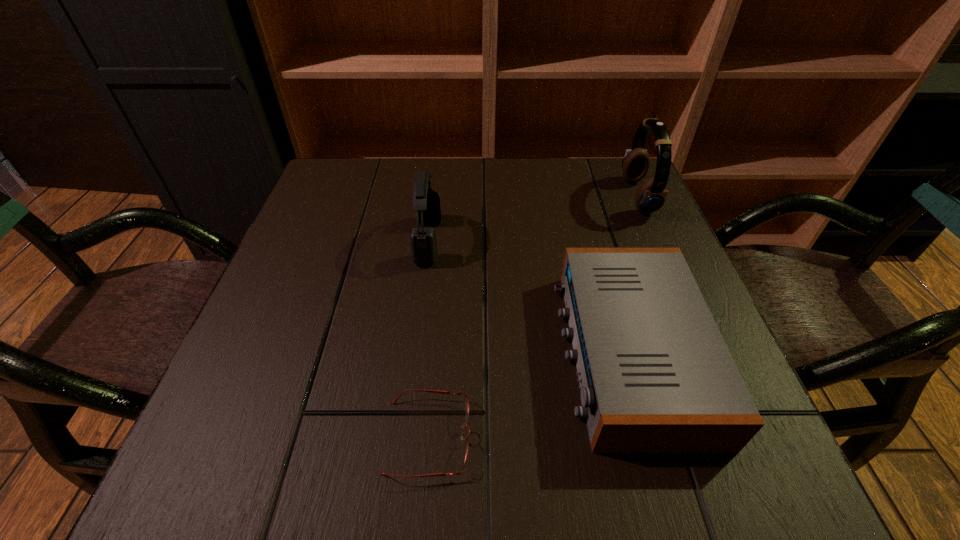
This screenshot has height=540, width=960. I want to click on vacant area between the shorter headset and the taller headset, so click(x=533, y=219).

The width and height of the screenshot is (960, 540). Find the location of `vacant area between the spectacles and the second tallest object`. vacant area between the spectacles and the second tallest object is located at coordinates (428, 339).

At what (x,y) coordinates should I click in order to perform the action: click on free space between the right headset and the second tallest object. Please return your answer as a coordinate pair (x, y). The height and width of the screenshot is (540, 960). Looking at the image, I should click on (533, 219).

Image resolution: width=960 pixels, height=540 pixels. I want to click on vacant region between the spectacles and the second tallest object, so click(x=428, y=339).

The width and height of the screenshot is (960, 540). In order to click on empty space that is in between the shorter headset and the right headset in this screenshot , I will do `click(533, 219)`.

Choose which object is the second nearest neighbor to the shortest object. Please provide its 2D coordinates. Your answer should be formatted as a tuple, i.e. [(x, y)], where the tuple contains the x and y coordinates of a point satisfying the conditions above.

[(426, 202)]

The height and width of the screenshot is (540, 960). I want to click on object that is the second closest to the radio receiver, so click(651, 195).